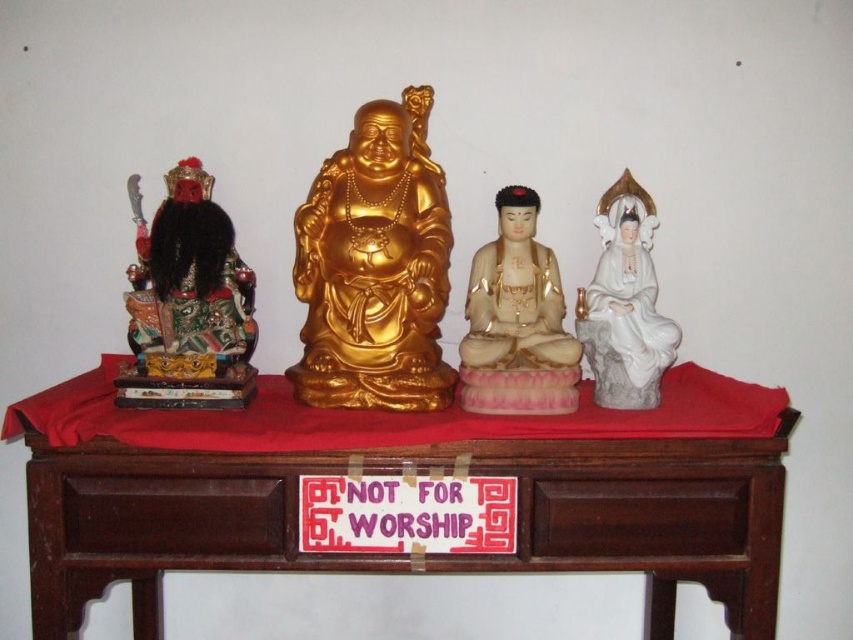
Question: Does multicolored painted wood statue at left have a larger size compared to white porcelain statue at center?

Choices:
 (A) no
 (B) yes

Answer: (B)

Question: Which of the following is the farthest from the observer?

Choices:
 (A) (663, 337)
 (B) (141, 273)
 (C) (514, 252)

Answer: (C)

Question: Observing the image, what is the correct spatial positioning of gold glossy statue at center in reference to multicolored painted wood statue at left?

Choices:
 (A) above
 (B) below

Answer: (A)

Question: Does gold glossy statue at center appear on the left side of multicolored painted wood statue at left?

Choices:
 (A) yes
 (B) no

Answer: (B)

Question: Among these objects, which one is farthest from the camera?

Choices:
 (A) gold glossy statue at center
 (B) white porcelain statue at right

Answer: (B)

Question: Which object appears closest to the camera in this image?

Choices:
 (A) gold glossy statue at center
 (B) multicolored painted wood statue at left
 (C) white porcelain statue at right
 (D) mahogany wood table at center

Answer: (D)